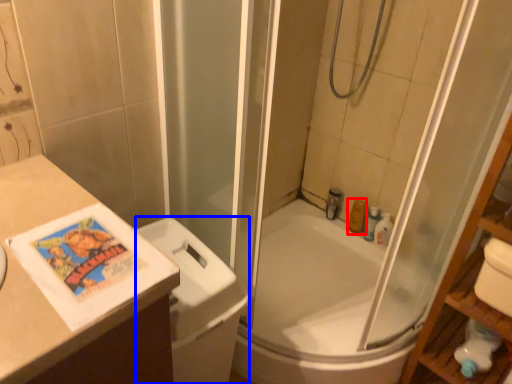
Question: Which point is closer to the camera, toiletry (highlighted by a red box) or toilet bowl (highlighted by a blue box)?

Choices:
 (A) toiletry
 (B) toilet bowl

Answer: (B)